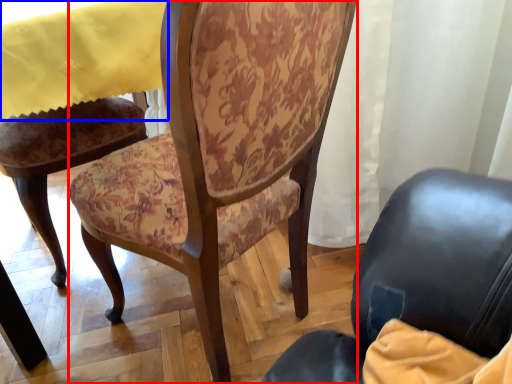
Question: Which object is closer to the camera taking this photo, chair (highlighted by a red box) or tablecloth (highlighted by a blue box)?

Choices:
 (A) chair
 (B) tablecloth

Answer: (A)